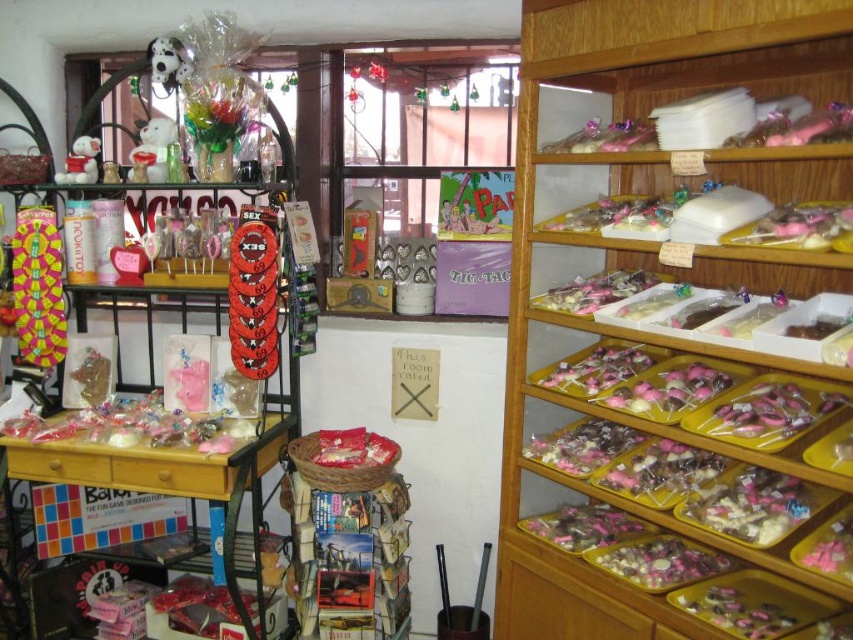
Can you confirm if red glossy disc at center is wider than matte black soccer ball at upper left?

In fact, red glossy disc at center might be narrower than matte black soccer ball at upper left.

Is red glossy disc at center positioned behind matte black soccer ball at upper left?

No.

Does point (263, 355) come closer to viewer compared to point (163, 67)?

Yes, it is.

This screenshot has width=853, height=640. In order to click on red glossy disc at center in this screenshot , I will do pos(253,300).

Does point (163, 138) lie in front of point (183, 65)?

No, it is behind (183, 65).

Can you confirm if white plush bear at upper left is positioned to the right of matte black soccer ball at upper left?

Incorrect, white plush bear at upper left is not on the right side of matte black soccer ball at upper left.

Does point (142, 134) come in front of point (170, 76)?

No.

Identify the location of white plush bear at upper left. (154, 150).

Who is positioned more to the right, wooden shelves at right or white plush bear at left?

Positioned to the right is wooden shelves at right.

The width and height of the screenshot is (853, 640). Identify the location of wooden shelves at right. (643, 268).